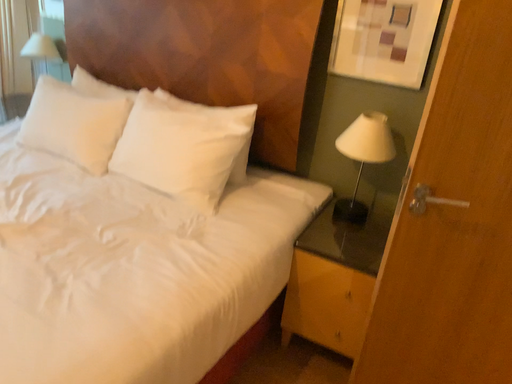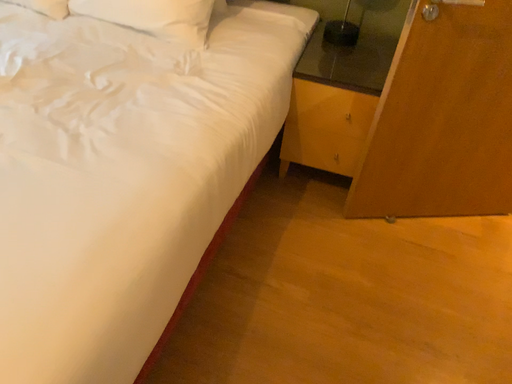
Question: How did the camera likely rotate when shooting the video?

Choices:
 (A) rotated right
 (B) rotated left

Answer: (A)